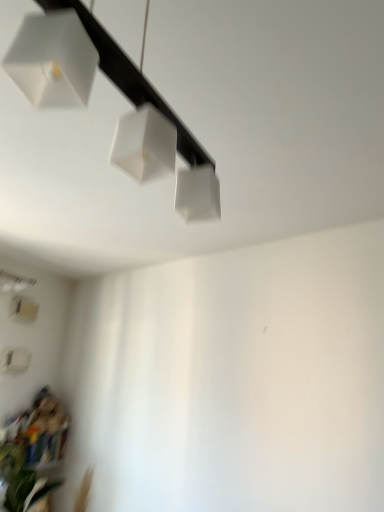
Question: Is white matte lampshade at lower left, the first lamp positioned from the bottom, placed right next to green leafy plant at lower left?

Choices:
 (A) no
 (B) yes

Answer: (A)

Question: From the image's perspective, is white matte lampshade at lower left, which is the 2th lamp in front-to-back order, below green leafy plant at lower left?

Choices:
 (A) no
 (B) yes

Answer: (A)

Question: Is white matte lampshade at lower left, which is the 2th lamp in front-to-back order, to the left of green leafy plant at lower left from the viewer's perspective?

Choices:
 (A) no
 (B) yes

Answer: (B)

Question: From a real-world perspective, is white matte lampshade at lower left, the second lamp viewed from the right, located beneath green leafy plant at lower left?

Choices:
 (A) no
 (B) yes

Answer: (A)

Question: Is white matte lampshade at lower left, positioned as the first lamp in left-to-right order, outside green leafy plant at lower left?

Choices:
 (A) no
 (B) yes

Answer: (B)

Question: Is white matte lampshade at lower left, positioned as the second lamp in top-to-bottom order, smaller than green leafy plant at lower left?

Choices:
 (A) yes
 (B) no

Answer: (A)

Question: Is white matte lampshade at lower left, positioned as the first lamp in left-to-right order, oriented away from white matte lamp at upper center, which is the first lamp in front-to-back order?

Choices:
 (A) yes
 (B) no

Answer: (B)

Question: Is white matte lampshade at lower left, which is the 2th lamp in front-to-back order, bigger than white matte lamp at upper center, acting as the first lamp starting from the right?

Choices:
 (A) no
 (B) yes

Answer: (A)

Question: Is white matte lampshade at lower left, positioned as the second lamp in top-to-bottom order, positioned before white matte lamp at upper center, acting as the first lamp starting from the top?

Choices:
 (A) no
 (B) yes

Answer: (A)

Question: Does white matte lampshade at lower left, the first lamp positioned from the bottom, have a smaller size compared to white matte lamp at upper center, positioned as the second lamp in bottom-to-top order?

Choices:
 (A) yes
 (B) no

Answer: (A)

Question: Considering the relative positions of white matte lampshade at lower left, the second lamp viewed from the right, and white matte lamp at upper center, the second lamp positioned from the back, in the image provided, is white matte lampshade at lower left, the second lamp viewed from the right, to the right of white matte lamp at upper center, the second lamp positioned from the back, from the viewer's perspective?

Choices:
 (A) no
 (B) yes

Answer: (A)

Question: Is the position of white matte lampshade at lower left, arranged as the first lamp when viewed from the back, more distant than that of white matte lamp at upper center, the second lamp positioned from the back?

Choices:
 (A) yes
 (B) no

Answer: (A)

Question: Is white matte lamp at upper center, acting as the first lamp starting from the top, taller than white matte lampshade at lower left, the first lamp positioned from the bottom?

Choices:
 (A) no
 (B) yes

Answer: (B)